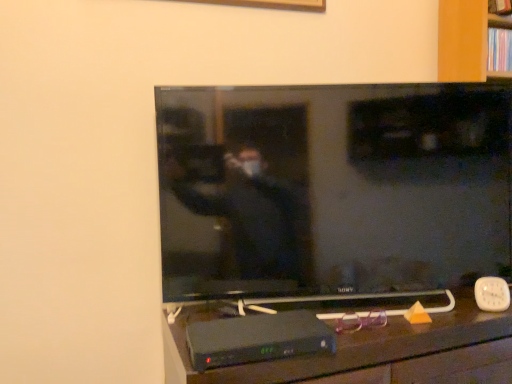
Question: Does flat screen tv at center have a smaller size compared to black plastic tv stand at lower center?

Choices:
 (A) yes
 (B) no

Answer: (A)

Question: Is flat screen tv at center looking in the opposite direction of black plastic tv stand at lower center?

Choices:
 (A) yes
 (B) no

Answer: (B)

Question: From the image's perspective, would you say flat screen tv at center is shown under black plastic tv stand at lower center?

Choices:
 (A) yes
 (B) no

Answer: (B)

Question: Can you confirm if flat screen tv at center is taller than black plastic tv stand at lower center?

Choices:
 (A) no
 (B) yes

Answer: (B)

Question: Are flat screen tv at center and black plastic tv stand at lower center making contact?

Choices:
 (A) yes
 (B) no

Answer: (B)

Question: Does flat screen tv at center have a larger size compared to black plastic tv stand at lower center?

Choices:
 (A) no
 (B) yes

Answer: (A)

Question: Does black plastic tv stand at lower center lie in front of flat screen tv at center?

Choices:
 (A) yes
 (B) no

Answer: (A)

Question: Would you say black plastic tv stand at lower center is a long distance from flat screen tv at center?

Choices:
 (A) yes
 (B) no

Answer: (B)

Question: Does black plastic tv stand at lower center come behind flat screen tv at center?

Choices:
 (A) no
 (B) yes

Answer: (A)

Question: Could flat screen tv at center be considered to be inside black plastic tv stand at lower center?

Choices:
 (A) no
 (B) yes

Answer: (A)

Question: Considering the relative sizes of black plastic tv stand at lower center and flat screen tv at center in the image provided, is black plastic tv stand at lower center shorter than flat screen tv at center?

Choices:
 (A) yes
 (B) no

Answer: (A)

Question: From a real-world perspective, does black plastic tv stand at lower center sit lower than flat screen tv at center?

Choices:
 (A) yes
 (B) no

Answer: (A)

Question: Is black plastic tv stand at lower center closer to the viewer compared to wooden bookshelf at upper right?

Choices:
 (A) yes
 (B) no

Answer: (A)